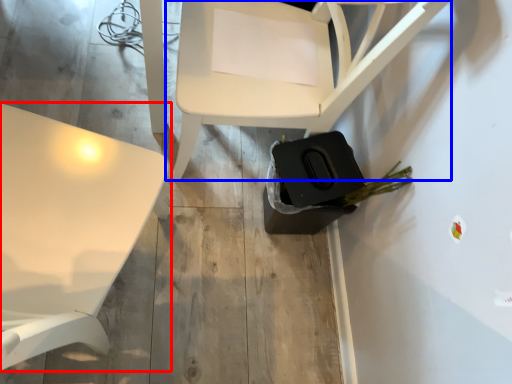
Question: Which of the following is the farthest to the observer, table (highlighted by a red box) or chair (highlighted by a blue box)?

Choices:
 (A) table
 (B) chair

Answer: (B)